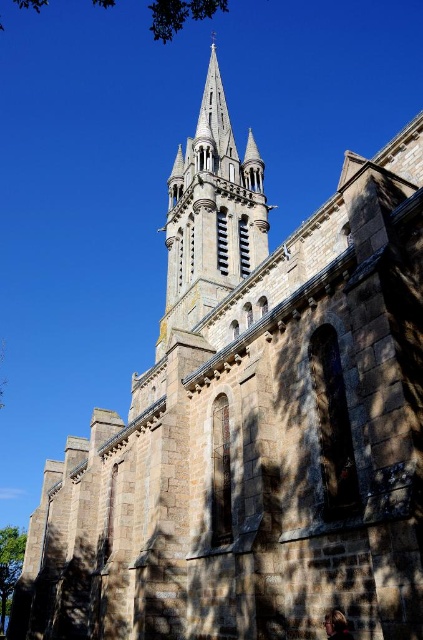
Question: Which point is closer to the camera taking this photo?

Choices:
 (A) (98, 3)
 (B) (11, 579)
 (C) (181, 266)

Answer: (C)

Question: Considering the relative positions of smooth stone tower at center and green leafy tree at lower left in the image provided, where is smooth stone tower at center located with respect to green leafy tree at lower left?

Choices:
 (A) right
 (B) left

Answer: (A)

Question: Which is nearer to the green leafy tree at lower left?

Choices:
 (A) green leafy tree at upper center
 (B) smooth stone tower at center

Answer: (B)

Question: Is green leafy tree at upper center wider than green leafy tree at lower left?

Choices:
 (A) yes
 (B) no

Answer: (A)

Question: Which object is the closest to the smooth stone tower at center?

Choices:
 (A) green leafy tree at upper center
 (B) green leafy tree at lower left

Answer: (A)

Question: Does smooth stone tower at center come in front of green leafy tree at lower left?

Choices:
 (A) no
 (B) yes

Answer: (B)